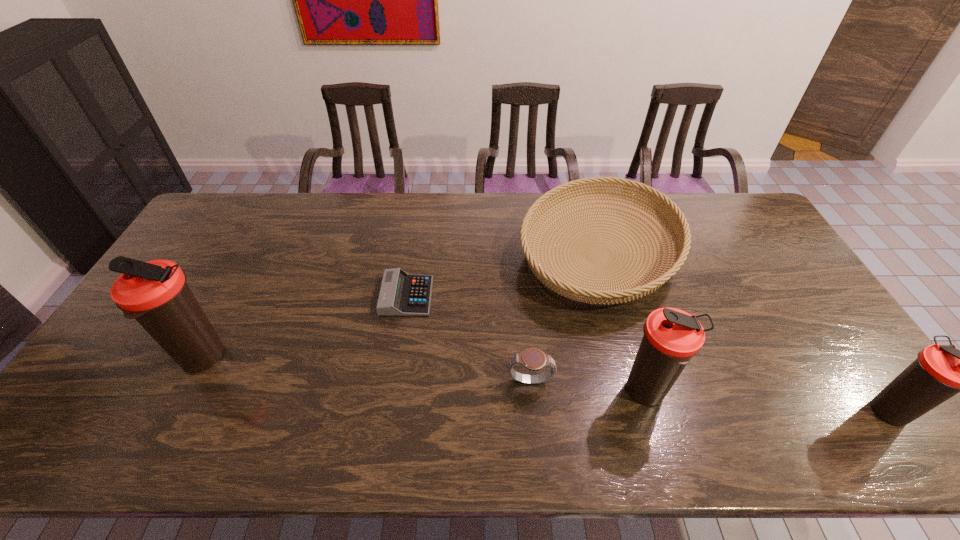
Identify the location of the leftmost object. (155, 293).

What are the coordinates of `the fifth shortest object` in the screenshot? It's located at (672, 337).

Identify the location of the second thermos bottle from left to right. This screenshot has width=960, height=540. (672, 337).

The width and height of the screenshot is (960, 540). Identify the location of the shortest thermos bottle. (940, 372).

This screenshot has height=540, width=960. What are the coordinates of `the fourth shortest object` in the screenshot? It's located at [940, 372].

Where is `basket`? This screenshot has height=540, width=960. basket is located at coordinates (572, 288).

Identify the location of the shortest object. (401, 294).

Find the location of a particular element. calculator is located at coordinates (401, 294).

Where is `watch`? This screenshot has height=540, width=960. watch is located at coordinates (533, 359).

The height and width of the screenshot is (540, 960). Find the location of `vacant space located on the back of the leftmost object`. vacant space located on the back of the leftmost object is located at coordinates (259, 249).